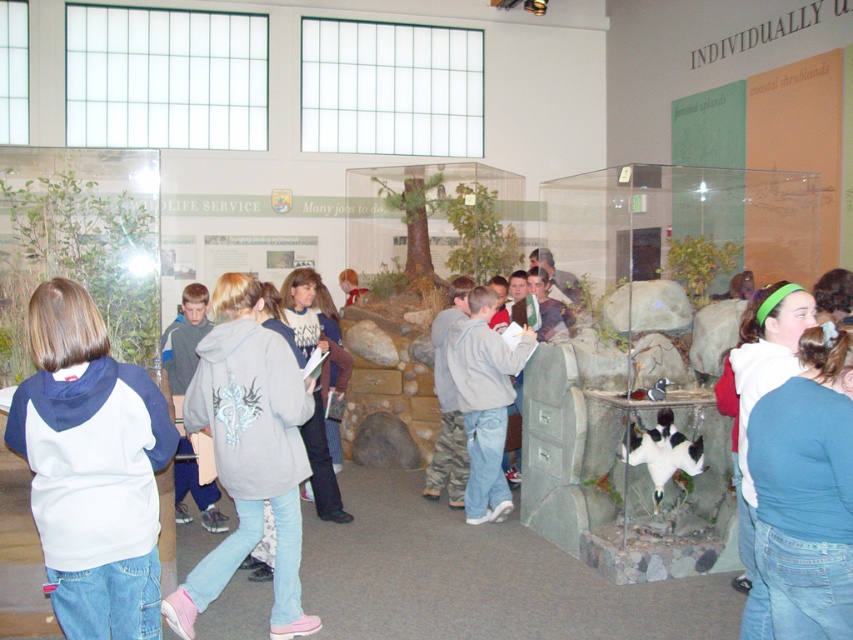
You are a tour guide in the museum and need to ensure that all visitors are visible through the glass enclosures. The light gray hoodie at center and the gray matte hoodie at center are both standing in front of the same enclosure. Which hoodie should you ask to move back so that the other can be seen clearly?

The light gray hoodie at center has a larger size compared to gray matte hoodie at center, so you should ask the light gray hoodie at center to move back to ensure the gray matte hoodie at center can be seen clearly.

You are a tour guide leading a group in the museum. You notice two visitors wearing a white fleece sweatshirt at center and a gray matte hoodie at center. They are standing in the same area. Can you determine if they are close enough to hear each other without raising their voices?

The white fleece sweatshirt at center and gray matte hoodie at center are 9.37 feet apart from each other. Since 9.37 feet is a reasonable distance for conversation without needing to raise voices, they can hear each other comfortably.

You are a security guard in the museum. You need to check if the light gray hoodie at center is within the 3 meters safety zone from the camera. Is it within the zone?

The light gray hoodie at center is 3.37 meters from the camera, so it is outside the 3 meters safety zone.